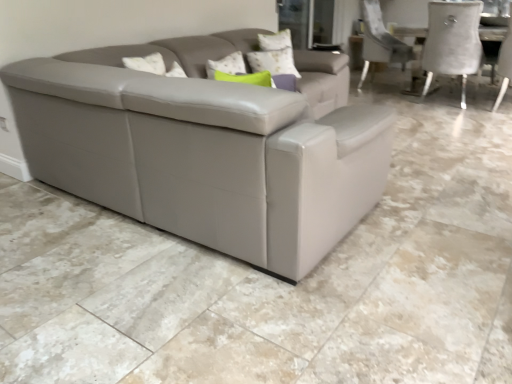
Question: Is white fabric chair at right oriented away from white textured pillow at upper center?

Choices:
 (A) yes
 (B) no

Answer: (B)

Question: Does white fabric chair at right have a larger size compared to white textured pillow at upper center?

Choices:
 (A) no
 (B) yes

Answer: (B)

Question: From the image's perspective, does white fabric chair at right appear higher than white textured pillow at upper center?

Choices:
 (A) no
 (B) yes

Answer: (B)

Question: Is white fabric chair at right at the left side of white textured pillow at upper center?

Choices:
 (A) no
 (B) yes

Answer: (A)

Question: Considering the relative positions of white fabric chair at right and white textured pillow at upper center in the image provided, is white fabric chair at right to the right of white textured pillow at upper center from the viewer's perspective?

Choices:
 (A) yes
 (B) no

Answer: (A)

Question: From the image's perspective, is white textured pillow at upper center positioned above or below white fabric chair at right?

Choices:
 (A) below
 (B) above

Answer: (A)

Question: From a real-world perspective, is white textured pillow at upper center above or below white fabric chair at right?

Choices:
 (A) above
 (B) below

Answer: (A)

Question: In terms of size, does white textured pillow at upper center appear bigger or smaller than white fabric chair at right?

Choices:
 (A) big
 (B) small

Answer: (B)

Question: Is point (253, 59) positioned closer to the camera than point (510, 61)?

Choices:
 (A) closer
 (B) farther

Answer: (A)

Question: In the image, is matte gray couch at center positioned in front of or behind white textured pillow at upper center?

Choices:
 (A) front
 (B) behind

Answer: (A)

Question: Considering the positions of point (238, 253) and point (259, 52), is point (238, 253) closer or farther from the camera than point (259, 52)?

Choices:
 (A) farther
 (B) closer

Answer: (B)

Question: Considering the positions of matte gray couch at center and white textured pillow at upper center in the image, is matte gray couch at center taller or shorter than white textured pillow at upper center?

Choices:
 (A) short
 (B) tall

Answer: (A)

Question: Looking at their shapes, would you say matte gray couch at center is wider or thinner than white textured pillow at upper center?

Choices:
 (A) wide
 (B) thin

Answer: (A)

Question: From the image's perspective, is transparent glass door at upper center located above or below white textured pillow at upper center?

Choices:
 (A) below
 (B) above

Answer: (B)

Question: Considering the positions of point (289, 9) and point (263, 52), is point (289, 9) closer or farther from the camera than point (263, 52)?

Choices:
 (A) closer
 (B) farther

Answer: (B)